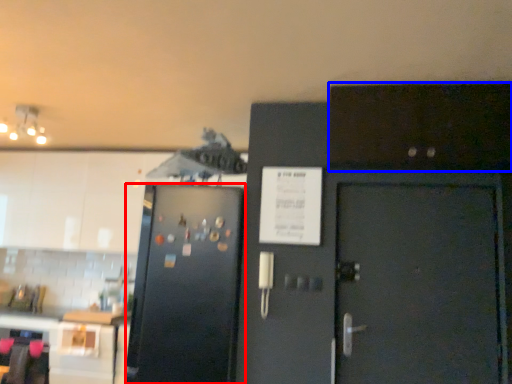
Question: Which object appears closest to the camera in this image, refrigerator (highlighted by a red box) or cabinetry (highlighted by a blue box)?

Choices:
 (A) refrigerator
 (B) cabinetry

Answer: (B)